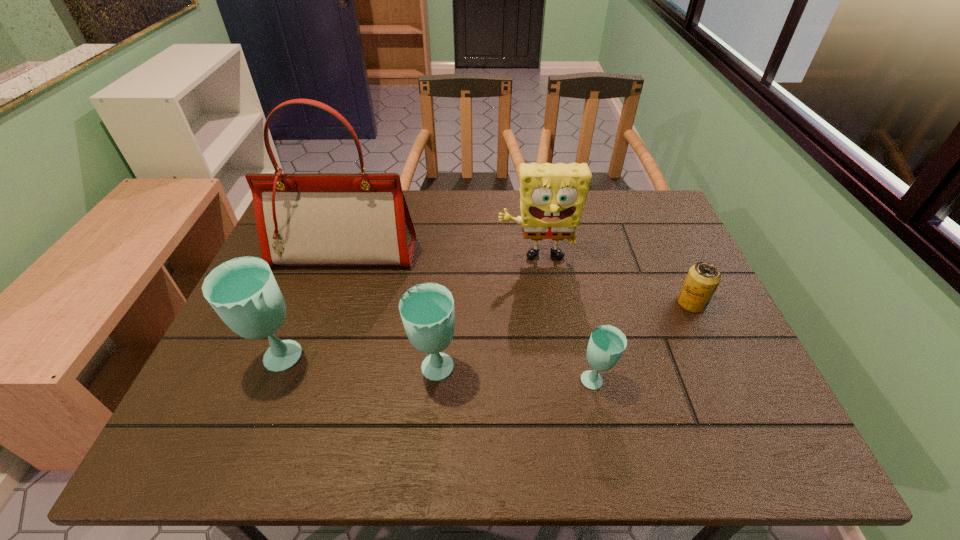
I want to click on the leftmost glass, so pos(243,291).

Identify the location of the third object from left to right. This screenshot has height=540, width=960. (427, 310).

Locate an element on the screen. This screenshot has width=960, height=540. the second glass from right to left is located at coordinates (427, 310).

Identify the location of the shortest glass. This screenshot has height=540, width=960. coord(607,343).

What are the coordinates of `the rightmost glass` in the screenshot? It's located at (607, 343).

I want to click on sponge, so click(x=552, y=196).

Identify the location of the rightmost object. (703, 278).

The height and width of the screenshot is (540, 960). What are the coordinates of `beer can` in the screenshot? It's located at tap(703, 278).

I want to click on handbag, so pyautogui.click(x=328, y=219).

I want to click on vacant space situated 0.050m on the right of the leftmost glass, so click(x=328, y=361).